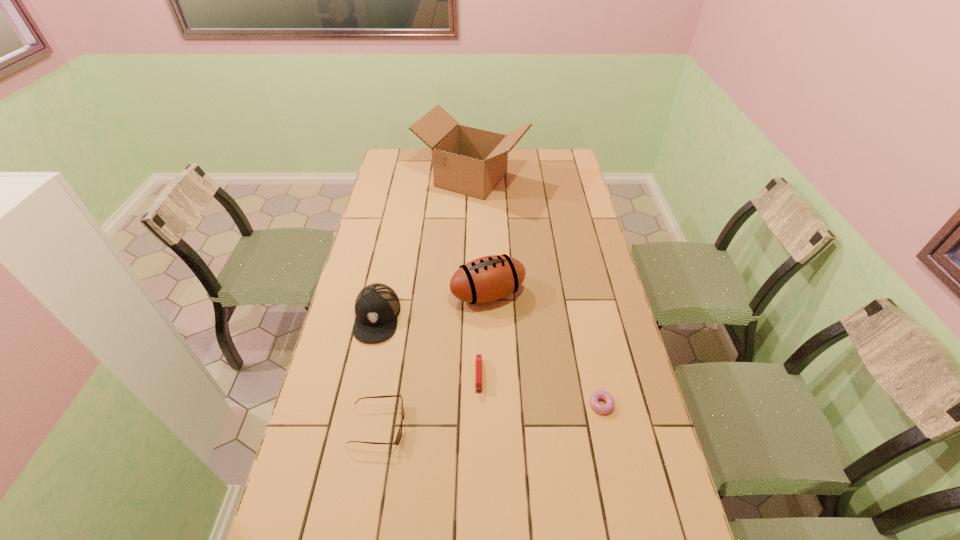
Locate an element on the screen. The image size is (960, 540). the farthest object is located at coordinates click(469, 161).

This screenshot has height=540, width=960. I want to click on the tallest object, so click(x=469, y=161).

What are the coordinates of `the second tallest object` in the screenshot? It's located at (489, 278).

I want to click on the third tallest object, so click(377, 306).

Image resolution: width=960 pixels, height=540 pixels. What are the coordinates of `stapler` in the screenshot? It's located at (478, 357).

Where is `sunglasses`? The image size is (960, 540). sunglasses is located at coordinates (399, 434).

Identify the location of doughnut. The image size is (960, 540). (599, 394).

Locate an element on the screen. the shortest object is located at coordinates (599, 394).

At what (x,y) coordinates should I click in order to perform the action: click on vacant space located on the right of the tallest object. Please return your answer as a coordinate pair (x, y). The image size is (960, 540). Looking at the image, I should click on (571, 179).

The height and width of the screenshot is (540, 960). I want to click on free region located on the right of the football (American), so click(554, 294).